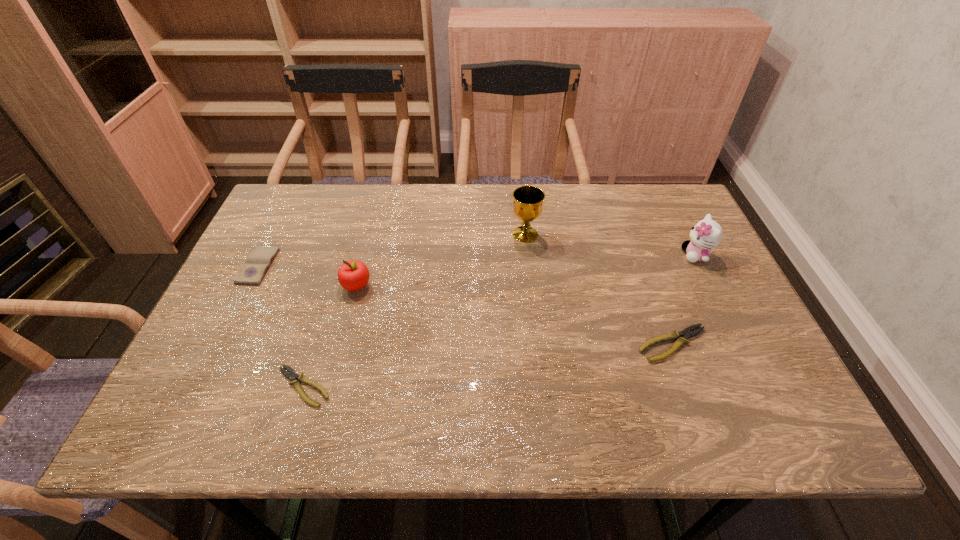
To make them evenly spaced by inserting another pliers among them, please locate a free space for this new pliers. Please provide its 2D coordinates. Your answer should be formatted as a tuple, i.e. [(x, y)], where the tuple contains the x and y coordinates of a point satisfying the conditions above.

[(495, 364)]